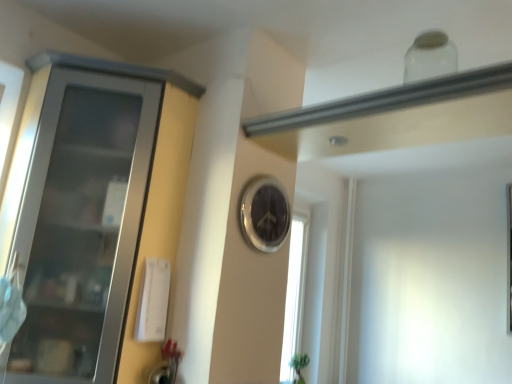
Question: Is metallic silver clock at center inside or outside of matte gray cabinet at left?

Choices:
 (A) inside
 (B) outside

Answer: (B)

Question: From a real-world perspective, is metallic silver clock at center positioned above or below matte gray cabinet at left?

Choices:
 (A) above
 (B) below

Answer: (A)

Question: Looking at their shapes, would you say metallic silver clock at center is wider or thinner than matte gray cabinet at left?

Choices:
 (A) thin
 (B) wide

Answer: (A)

Question: Is matte gray cabinet at left inside or outside of metallic silver clock at center?

Choices:
 (A) inside
 (B) outside

Answer: (B)

Question: From the image's perspective, is matte gray cabinet at left positioned above or below metallic silver clock at center?

Choices:
 (A) above
 (B) below

Answer: (B)

Question: From their relative heights in the image, would you say matte gray cabinet at left is taller or shorter than metallic silver clock at center?

Choices:
 (A) short
 (B) tall

Answer: (B)

Question: Is matte gray cabinet at left wider or thinner than metallic silver clock at center?

Choices:
 (A) thin
 (B) wide

Answer: (B)